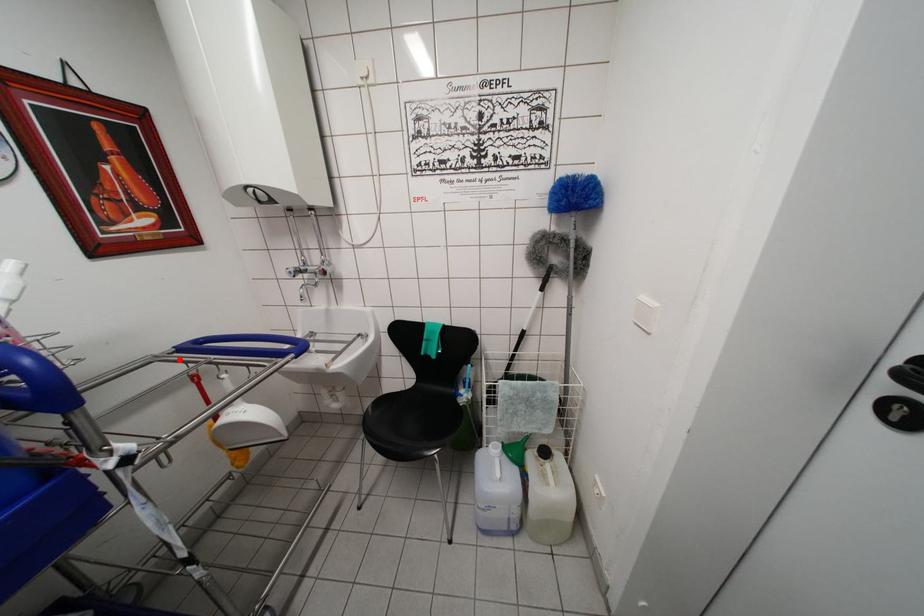
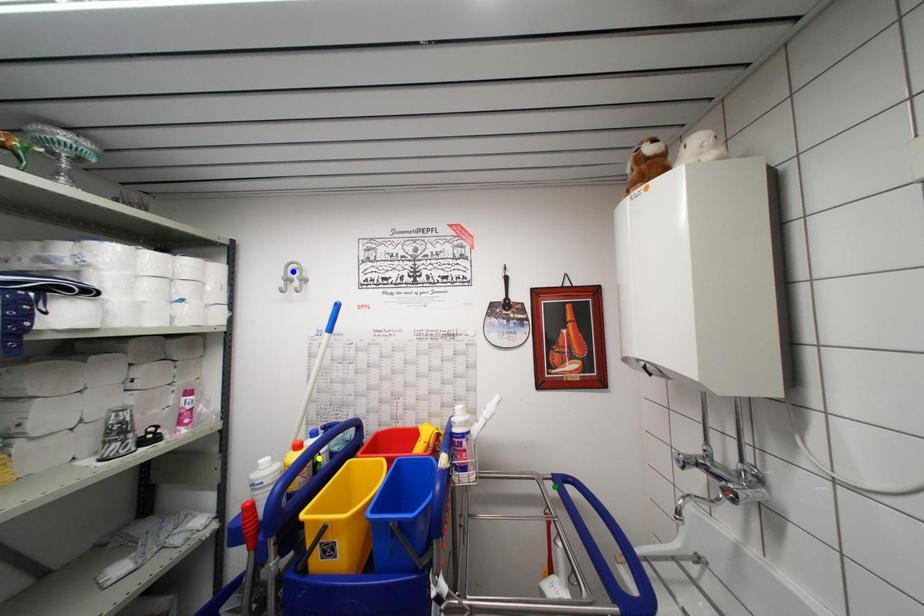
Question: I am providing you with two images of the same scene from different viewpoints. A red point is marked on the first image. You are given multiple points on the second image. Can you choose the point in image 2 that corresponds to the point in image 1?

Choices:
 (A) green point
 (B) yellow point
 (C) blue point

Answer: (A)